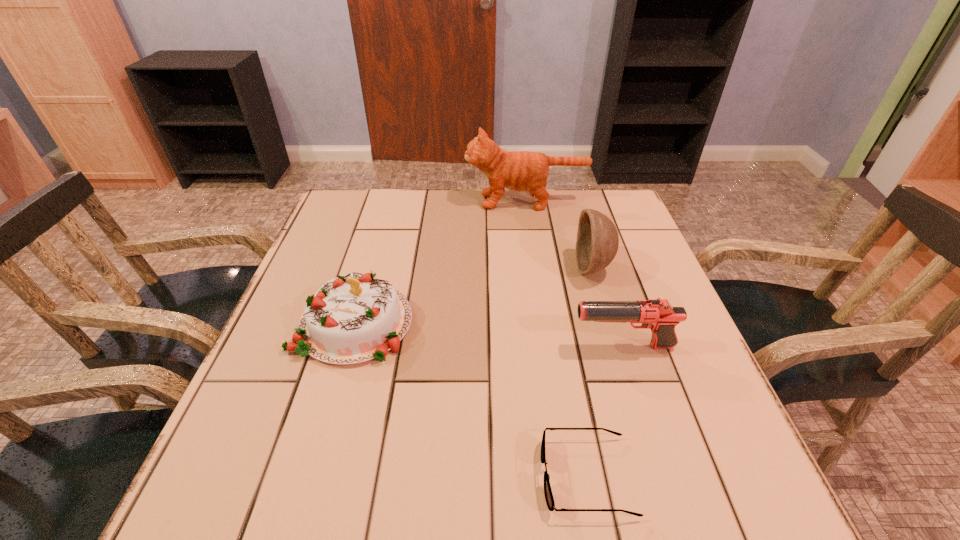
Identify the location of object present at the left edge. This screenshot has width=960, height=540. (x=353, y=318).

You are a GUI agent. You are given a task and a screenshot of the screen. Output one action in this format:
    pyautogui.click(x=<x>, y=<y>)
    Task: Click on the cat positioned at the right edge
    
    Given the screenshot: What is the action you would take?
    pyautogui.click(x=520, y=171)

Where is `bowl that is at the right edge`? bowl that is at the right edge is located at coordinates (597, 242).

Locate an element on the screen. gun located at the right edge is located at coordinates (659, 315).

Where is `object that is at the far right corner`? object that is at the far right corner is located at coordinates (520, 171).

At what (x,y) coordinates should I click in order to perform the action: click on free space at the far edge. Please return your answer as a coordinate pair (x, y). Looking at the image, I should click on (433, 233).

In the image, there is a desktop. What are the coordinates of `vacant space at the near edge` in the screenshot? It's located at (444, 479).

Where is `vacant space at the left edge of the desktop`? Image resolution: width=960 pixels, height=540 pixels. vacant space at the left edge of the desktop is located at coordinates (360, 262).

Identify the location of free space at the right edge of the desktop. Image resolution: width=960 pixels, height=540 pixels. (698, 353).

This screenshot has height=540, width=960. What are the coordinates of `free space at the far left corner of the desktop` in the screenshot? It's located at (369, 214).